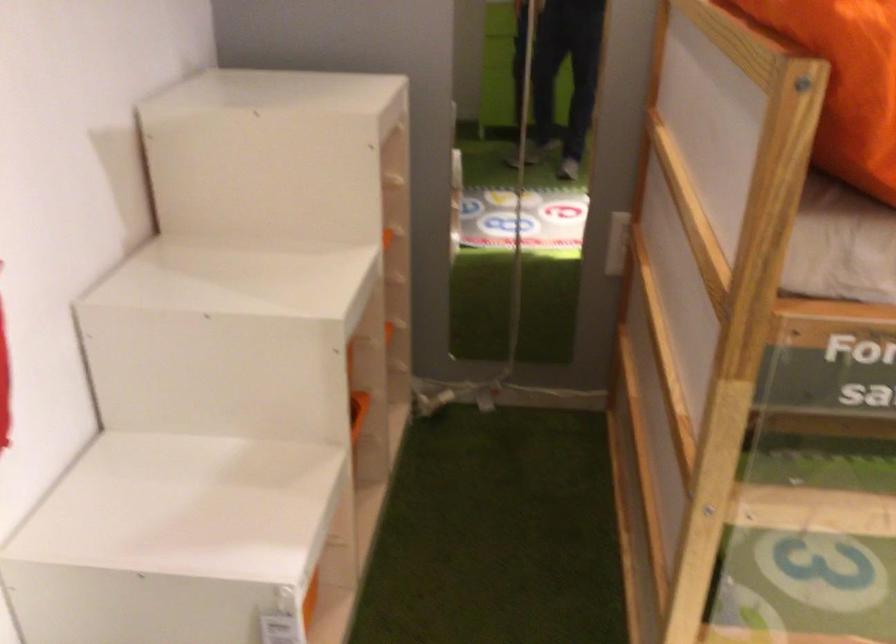
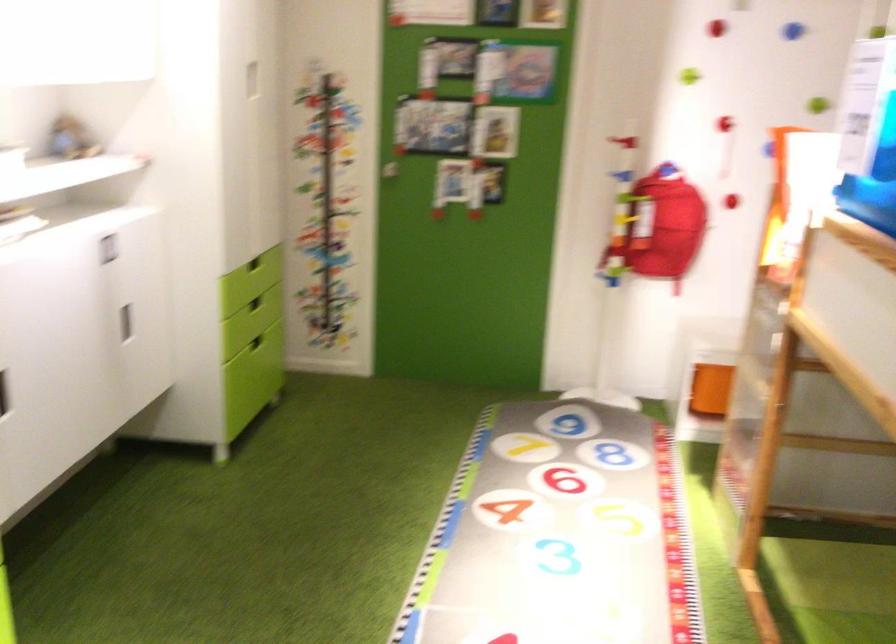
Question: I am providing you with two images of the same scene from different viewpoints. Which of the following objects are not visible in image2?

Choices:
 (A) blue climbing hold
 (B) orange pillow
 (C) red climbing hold
 (D) container with red lid

Answer: (B)